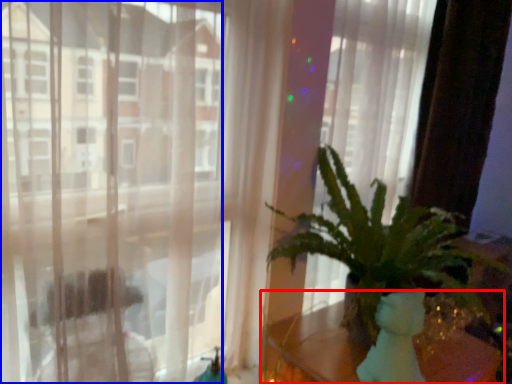
Question: Which of the following is the closest to the observer, table (highlighted by a red box) or window (highlighted by a blue box)?

Choices:
 (A) table
 (B) window

Answer: (B)